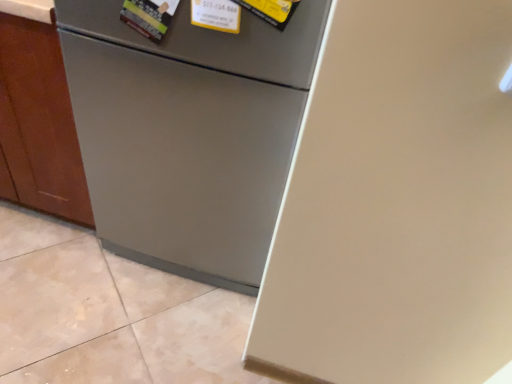
What do you see at coordinates (188, 133) in the screenshot?
I see `satin gray refrigerator at center` at bounding box center [188, 133].

Where is `satin gray refrigerator at center`? satin gray refrigerator at center is located at coordinates (188, 133).

Where is `satin gray refrigerator at center`? The height and width of the screenshot is (384, 512). satin gray refrigerator at center is located at coordinates (188, 133).